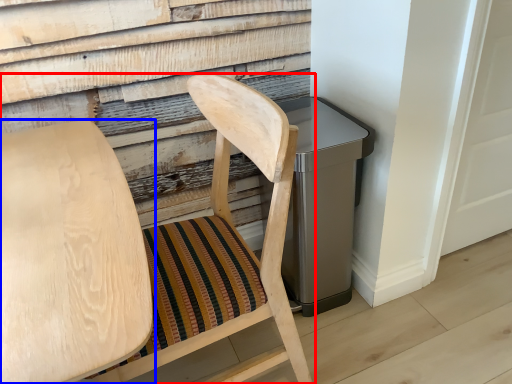
Question: Among these objects, which one is nearest to the camera, chair (highlighted by a red box) or chair (highlighted by a blue box)?

Choices:
 (A) chair
 (B) chair

Answer: (B)